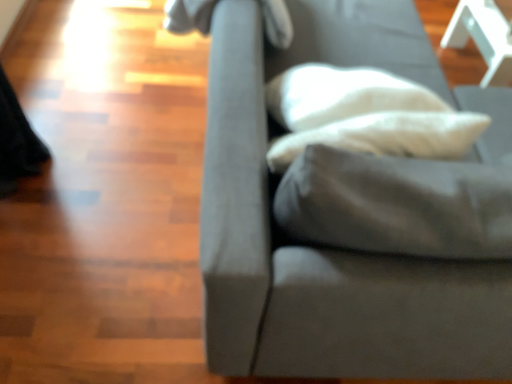
At what (x,y) coordinates should I click in order to perform the action: click on matte gray couch at right. Please return your answer as a coordinate pair (x, y). The image size is (512, 384). Looking at the image, I should click on (323, 249).

What do you see at coordinates (323, 249) in the screenshot? I see `matte gray couch at right` at bounding box center [323, 249].

Image resolution: width=512 pixels, height=384 pixels. I want to click on matte gray couch at right, so click(323, 249).